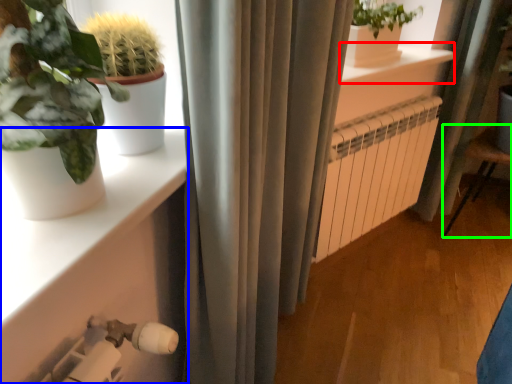
Question: Estimate the real-world distances between objects in this image. Which object is closer to window sill (highlighted by a red box), shelf (highlighted by a blue box) or armchair (highlighted by a green box)?

Choices:
 (A) shelf
 (B) armchair

Answer: (B)